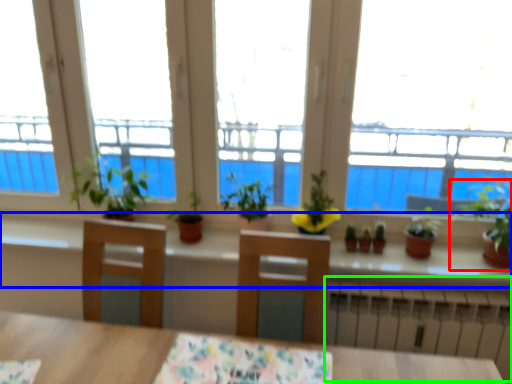
Question: Which object is the farthest from houseplant (highlighted by a red box)? Choose among these: window sill (highlighted by a blue box) or radiator (highlighted by a green box).

Choices:
 (A) window sill
 (B) radiator

Answer: (B)